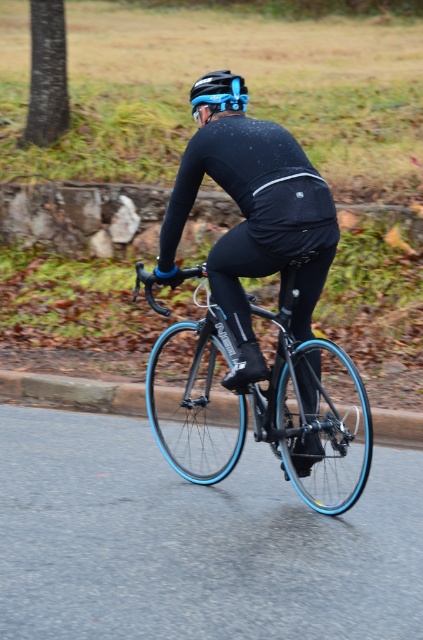
Is blue glossy bicycle at center closer to camera compared to blue matte bicycle helmet at upper center?

Yes, it is.

Does blue glossy bicycle at center appear on the right side of blue matte bicycle helmet at upper center?

Yes, blue glossy bicycle at center is to the right of blue matte bicycle helmet at upper center.

Between point (158, 356) and point (205, 84), which one is positioned behind?

Positioned behind is point (158, 356).

Locate an element on the screen. blue glossy bicycle at center is located at coordinates (266, 408).

Does matte black cycling suit at center have a lesser height compared to blue glossy bicycle at center?

In fact, matte black cycling suit at center may be taller than blue glossy bicycle at center.

Is point (307, 234) in front of point (329, 484)?

Yes, point (307, 234) is closer to viewer.

This screenshot has width=423, height=640. Find the location of `matte black cycling suit at center`. matte black cycling suit at center is located at coordinates 253,225.

Can you confirm if matte black cycling suit at center is positioned below blue matte bicycle helmet at upper center?

Yes, matte black cycling suit at center is below blue matte bicycle helmet at upper center.

From the picture: Who is more forward, (236, 166) or (216, 93)?

Point (236, 166)

Locate an element on the screen. matte black cycling suit at center is located at coordinates (253, 225).